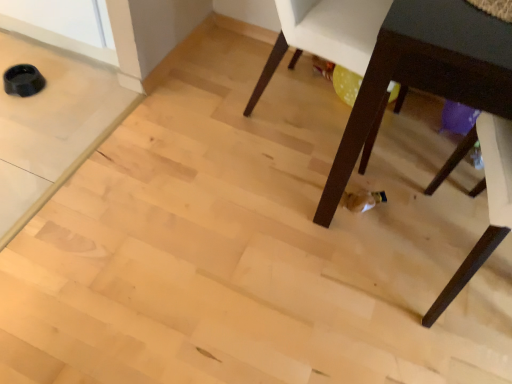
Locate an element on the screen. vacant space in white plastic chair at center, which is the first chair in top-to-bottom order (from a real-world perspective) is located at coordinates (301, 106).